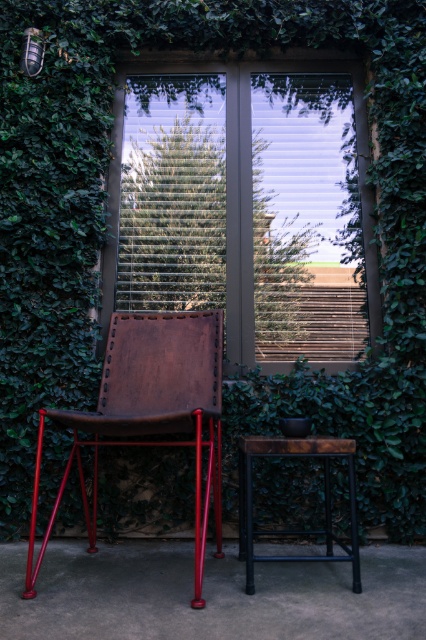
You are sitting on a chair near the rustic wood table at center and want to look out the matte glass window at center. Can you see the window from your current position without moving your head?

The matte glass window at center is above the rustic wood table at center, so yes, you can see it from your current position by looking upward.

You are sitting in a chair facing the matte glass window at center and the rustic wood table at center. Which object is closer to you?

The matte glass window at center is closer to you because it is further to the viewer than the rustic wood table at center.